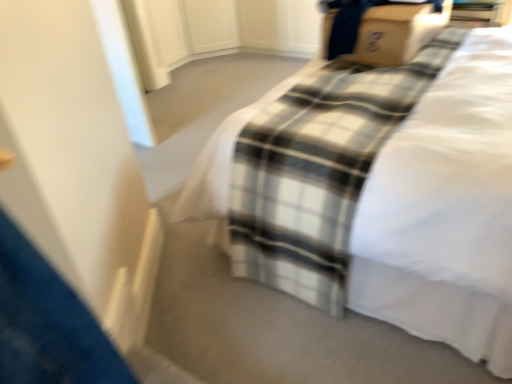
Question: From the image's perspective, would you say white cotton bed at center is shown under cardboard box at upper right?

Choices:
 (A) yes
 (B) no

Answer: (A)

Question: Considering the relative sizes of white cotton bed at center and cardboard box at upper right in the image provided, is white cotton bed at center taller than cardboard box at upper right?

Choices:
 (A) no
 (B) yes

Answer: (B)

Question: Is white cotton bed at center shorter than cardboard box at upper right?

Choices:
 (A) yes
 (B) no

Answer: (B)

Question: Is white cotton bed at center aimed at cardboard box at upper right?

Choices:
 (A) yes
 (B) no

Answer: (A)

Question: Would you consider white cotton bed at center to be distant from cardboard box at upper right?

Choices:
 (A) no
 (B) yes

Answer: (A)

Question: From a real-world perspective, is white cotton bed at center positioned over cardboard box at upper right based on gravity?

Choices:
 (A) no
 (B) yes

Answer: (A)

Question: Is cardboard box at upper right at the left side of white cotton bed at center?

Choices:
 (A) yes
 (B) no

Answer: (B)

Question: Is cardboard box at upper right positioned beyond the bounds of white cotton bed at center?

Choices:
 (A) yes
 (B) no

Answer: (B)

Question: From a real-world perspective, is cardboard box at upper right located beneath white cotton bed at center?

Choices:
 (A) no
 (B) yes

Answer: (A)

Question: Considering the relative sizes of cardboard box at upper right and white cotton bed at center in the image provided, is cardboard box at upper right thinner than white cotton bed at center?

Choices:
 (A) no
 (B) yes

Answer: (B)

Question: Is cardboard box at upper right oriented away from white cotton bed at center?

Choices:
 (A) yes
 (B) no

Answer: (A)

Question: Does cardboard box at upper right come behind white cotton bed at center?

Choices:
 (A) no
 (B) yes

Answer: (B)

Question: Considering the positions of point (495, 288) and point (413, 33), is point (495, 288) closer or farther from the camera than point (413, 33)?

Choices:
 (A) closer
 (B) farther

Answer: (A)